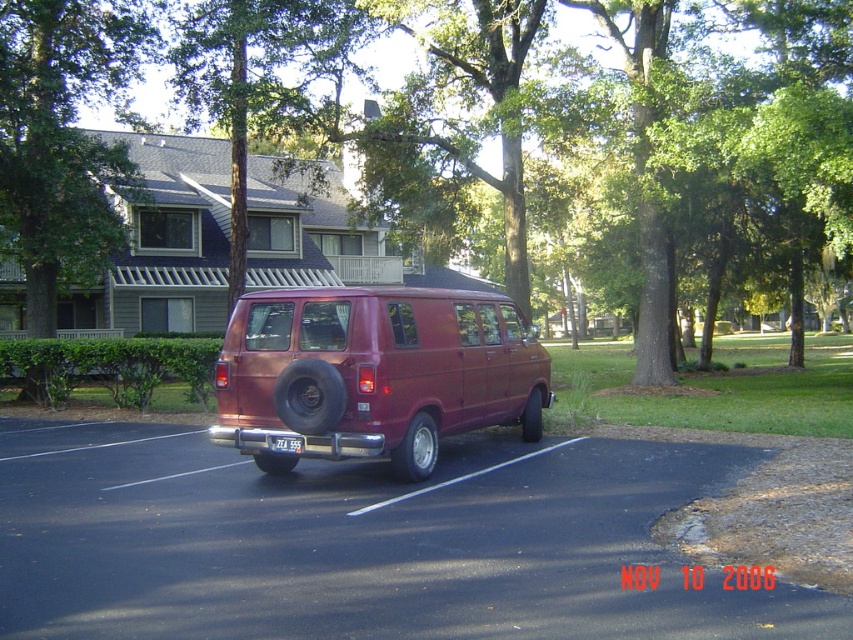
You are a delivery driver who needs to park your van in the parking lot. The van requires a parking space that is at least 15 meters away from any obstacles. Based on the scene, can you safely park in the black asphalt parking lot at center without being too close to the green leafy tree at upper left?

The distance between the black asphalt parking lot at center and the green leafy tree at upper left is 16.83 meters, which is more than the required 15 meters. Therefore, you can safely park in the black asphalt parking lot at center without being too close to the green leafy tree at upper left.

You are a delivery driver who needs to park your vehicle in the parking lot. When you look at the black asphalt parking lot at center and the green leafy tree at center, which one is closer to you as you approach the parking area?

The black asphalt parking lot at center is closer to you because it is in front of the green leafy tree at center, meaning the tree is further away in the background.

You are a driver who just arrived at the parking lot. You need to park your car in the black asphalt parking lot at center. However, there is a green leafy tree at upper left nearby. Based on their sizes, which one is taller?

The green leafy tree at upper left is taller than the black asphalt parking lot at center.